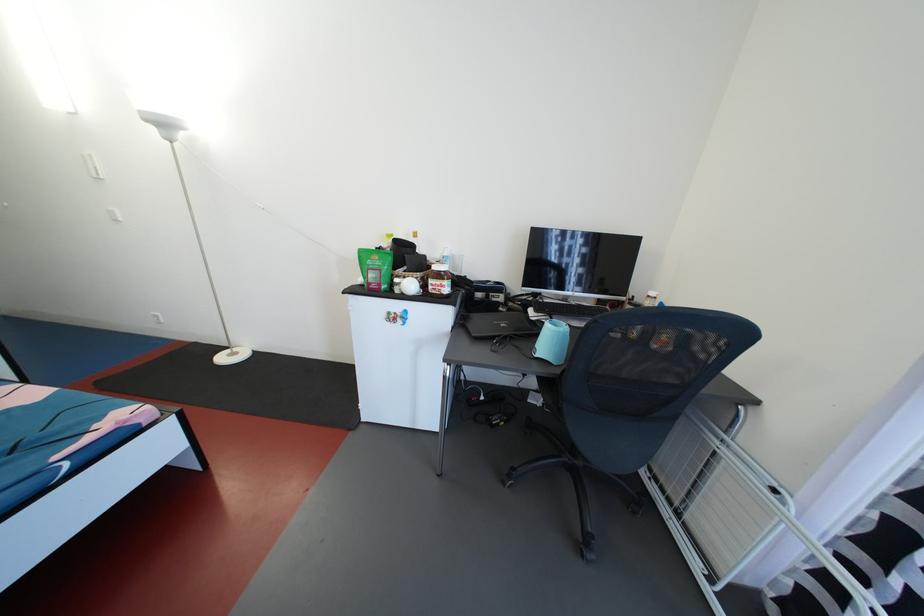
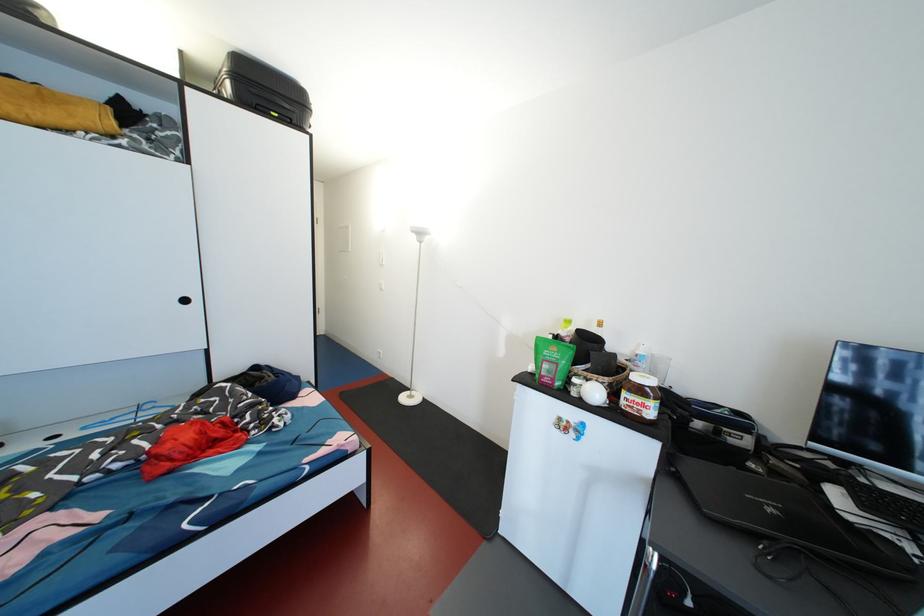
Question: I am providing you with two images of the same scene from different viewpoints. Please identify which objects are invisible in image2.

Choices:
 (A) black door handle
 (B) green food bag
 (C) closed black laptop
 (D) none of these

Answer: (D)